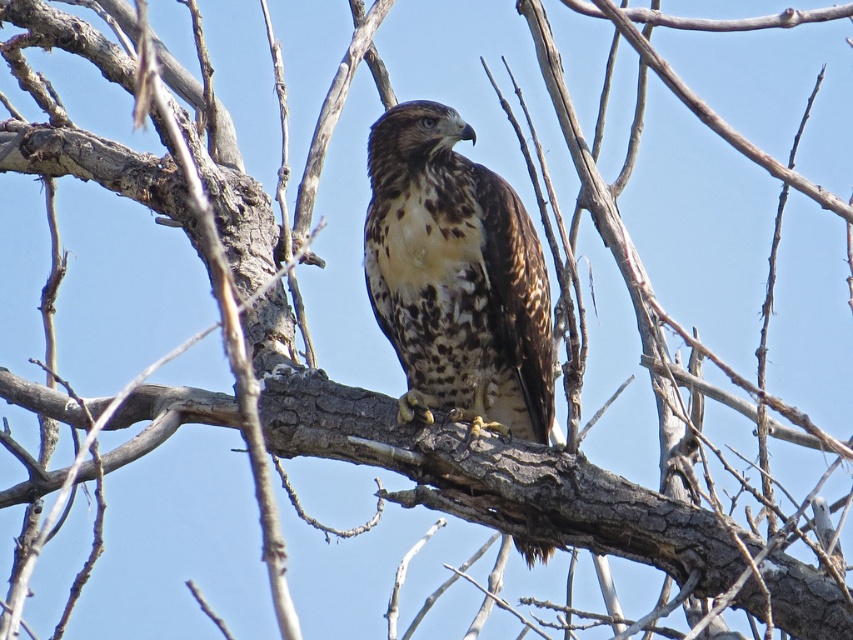
Can you confirm if brown speckled eagle at center is wider than brown speckled hawk at center?

Correct, the width of brown speckled eagle at center exceeds that of brown speckled hawk at center.

Between point (428, 128) and point (816, 531), which one is positioned in front?

Point (816, 531)

Is point (434, 220) positioned in front of point (825, 531)?

No, (434, 220) is behind (825, 531).

Identify the location of brown speckled eagle at center. This screenshot has width=853, height=640. (456, 276).